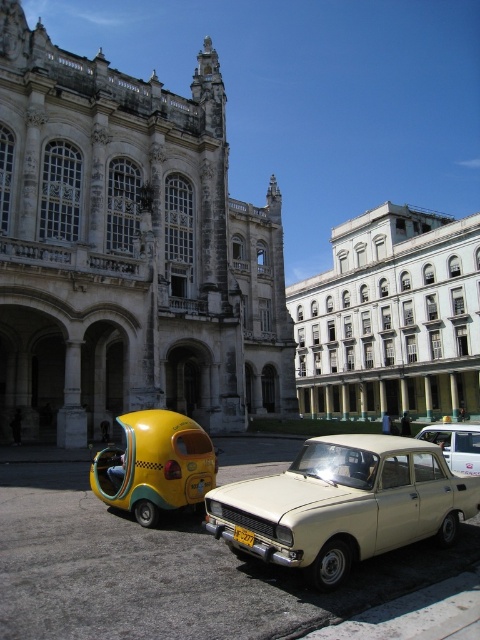
Question: Does white stone building at left come in front of white matte sedan at center?

Choices:
 (A) no
 (B) yes

Answer: (A)

Question: Considering the relative positions of beige matte sedan at center and white matte sedan at center in the image provided, where is beige matte sedan at center located with respect to white matte sedan at center?

Choices:
 (A) left
 (B) right

Answer: (A)

Question: Among these objects, which one is nearest to the camera?

Choices:
 (A) yellow matte taxi at lower left
 (B) beige matte sedan at center

Answer: (B)

Question: Is white stone building at left further to camera compared to yellow matte taxi at lower left?

Choices:
 (A) yes
 (B) no

Answer: (A)

Question: Which point appears farthest from the camera in this image?

Choices:
 (A) (428, 440)
 (B) (274, 524)
 (C) (91, 388)

Answer: (C)

Question: Which is farther from the white stone building at left?

Choices:
 (A) white glossy building at upper center
 (B) yellow plastic license plate at center
 (C) white matte sedan at center
 (D) beige matte sedan at center

Answer: (B)